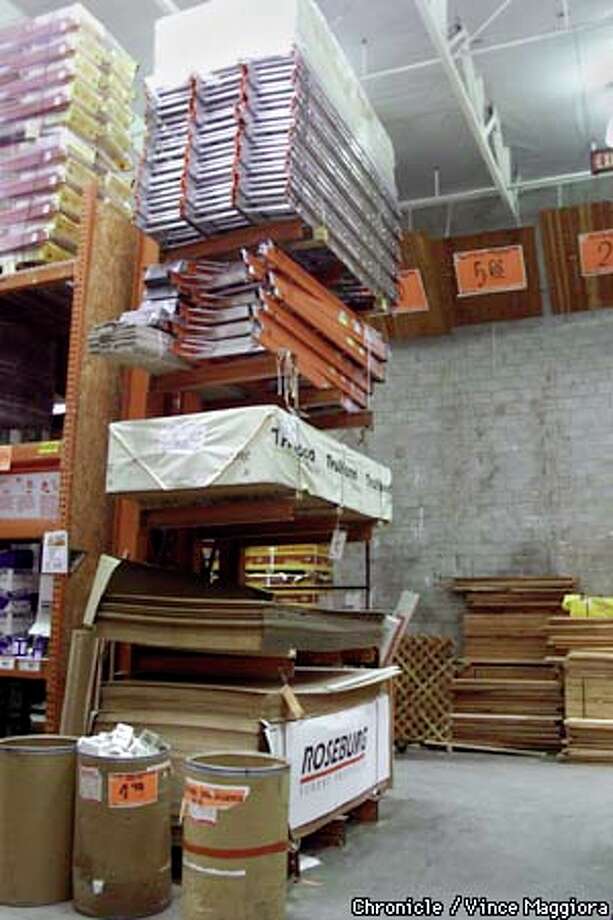
The width and height of the screenshot is (613, 920). I want to click on floor, so click(482, 848).